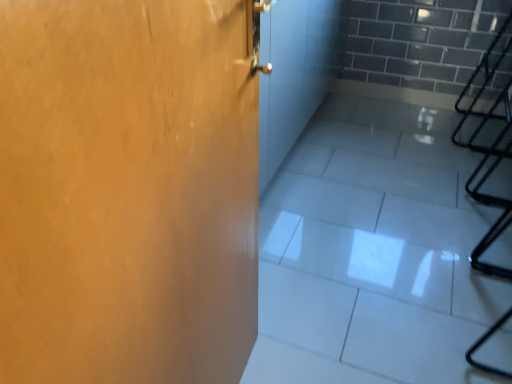
Question: Is white glossy tile at center not within matte wood door at left?

Choices:
 (A) yes
 (B) no

Answer: (A)

Question: From a real-world perspective, is white glossy tile at center physically below matte wood door at left?

Choices:
 (A) yes
 (B) no

Answer: (A)

Question: Can you confirm if white glossy tile at center is taller than matte wood door at left?

Choices:
 (A) no
 (B) yes

Answer: (A)

Question: From the image's perspective, does white glossy tile at center appear lower than matte wood door at left?

Choices:
 (A) no
 (B) yes

Answer: (A)

Question: Can you confirm if white glossy tile at center is wider than matte wood door at left?

Choices:
 (A) yes
 (B) no

Answer: (A)

Question: Would you say white glossy tile at center is a long distance from matte wood door at left?

Choices:
 (A) no
 (B) yes

Answer: (A)

Question: Is the depth of matte wood door at left less than that of white glossy tile at center?

Choices:
 (A) yes
 (B) no

Answer: (A)

Question: Does matte wood door at left have a lesser width compared to white glossy tile at center?

Choices:
 (A) no
 (B) yes

Answer: (B)

Question: From a real-world perspective, is matte wood door at left over white glossy tile at center?

Choices:
 (A) yes
 (B) no

Answer: (A)

Question: Can you confirm if matte wood door at left is bigger than white glossy tile at center?

Choices:
 (A) no
 (B) yes

Answer: (A)

Question: From the image's perspective, is matte wood door at left above white glossy tile at center?

Choices:
 (A) yes
 (B) no

Answer: (B)

Question: Can you confirm if matte wood door at left is positioned to the right of white glossy tile at center?

Choices:
 (A) yes
 (B) no

Answer: (B)

Question: Considering the positions of matte wood door at left and white glossy tile at center in the image, is matte wood door at left wider or thinner than white glossy tile at center?

Choices:
 (A) thin
 (B) wide

Answer: (A)